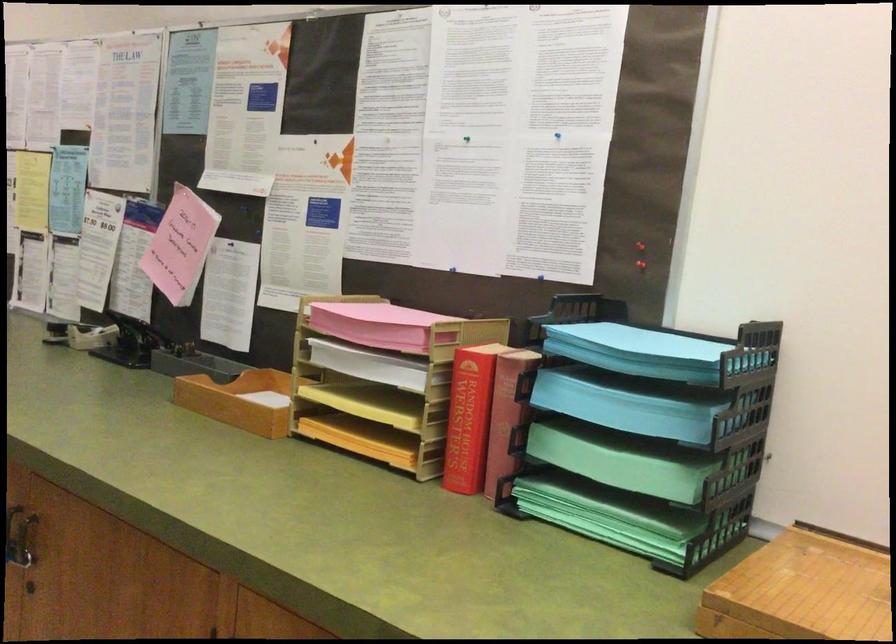
The height and width of the screenshot is (644, 896). What do you see at coordinates (19, 536) in the screenshot?
I see `a cabinet lock handle` at bounding box center [19, 536].